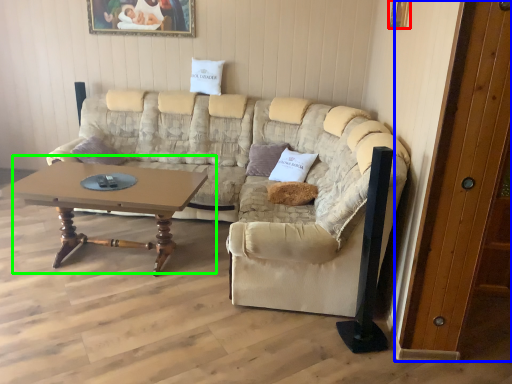
Question: Estimate the real-world distances between objects in this image. Which object is farther from picture frame (highlighted by a red box), door (highlighted by a blue box) or coffee table (highlighted by a green box)?

Choices:
 (A) door
 (B) coffee table

Answer: (B)